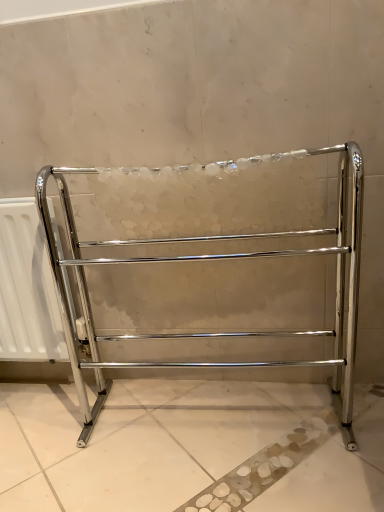
Image resolution: width=384 pixels, height=512 pixels. What do you see at coordinates (204, 260) in the screenshot?
I see `polished chrome towel rack at center` at bounding box center [204, 260].

Measure the distance between polished chrome towel rack at center and camera.

polished chrome towel rack at center is 38.34 inches away from camera.

I want to click on polished chrome towel rack at center, so click(204, 260).

What do you see at coordinates (27, 288) in the screenshot? I see `white matte radiator at left` at bounding box center [27, 288].

The height and width of the screenshot is (512, 384). I want to click on white matte radiator at left, so click(x=27, y=288).

This screenshot has height=512, width=384. In order to click on polished chrome towel rack at center in this screenshot , I will do `click(204, 260)`.

Considering the relative positions of polished chrome towel rack at center and white matte radiator at left in the image provided, is polished chrome towel rack at center to the right of white matte radiator at left from the viewer's perspective?

Correct, you'll find polished chrome towel rack at center to the right of white matte radiator at left.

Which object is more forward, polished chrome towel rack at center or white matte radiator at left?

polished chrome towel rack at center.

Between point (347, 196) and point (46, 333), which one is positioned in front?

Positioned in front is point (347, 196).

From the image's perspective, who appears lower, polished chrome towel rack at center or white matte radiator at left?

white matte radiator at left appears lower in the image.

Looking at this image, from a real-world perspective, is polished chrome towel rack at center located beneath white matte radiator at left?

Incorrect, from a real-world perspective, polished chrome towel rack at center is higher than white matte radiator at left.

Which of these two, polished chrome towel rack at center or white matte radiator at left, is thinner?

white matte radiator at left.

Which of these two, polished chrome towel rack at center or white matte radiator at left, stands taller?

polished chrome towel rack at center.

Based on their sizes in the image, would you say polished chrome towel rack at center is bigger or smaller than white matte radiator at left?

Clearly, polished chrome towel rack at center is larger in size than white matte radiator at left.

Is polished chrome towel rack at center spatially inside white matte radiator at left, or outside of it?

polished chrome towel rack at center is outside white matte radiator at left.

Is polished chrome towel rack at center in contact with white matte radiator at left?

polished chrome towel rack at center is not next to white matte radiator at left, and they're not touching.

Is polished chrome towel rack at center facing away from white matte radiator at left?

No, polished chrome towel rack at center is not facing the opposite direction of white matte radiator at left.

What's the angular difference between polished chrome towel rack at center and white matte radiator at left's facing directions?

There is a 2.97-degree angle between the facing directions of polished chrome towel rack at center and white matte radiator at left.

At what (x,y) coordinates should I click in order to perform the action: click on furniture positioned vertically above the white matte radiator at left (from a real-world perspective). Please return your answer as a coordinate pair (x, y). The height and width of the screenshot is (512, 384). Looking at the image, I should click on (204, 260).

Consider the image. Considering the positions of objects white matte radiator at left and polished chrome towel rack at center in the image provided, who is more to the left, white matte radiator at left or polished chrome towel rack at center?

white matte radiator at left.

Is the depth of white matte radiator at left greater than that of polished chrome towel rack at center?

Yes, the depth of white matte radiator at left is greater than that of polished chrome towel rack at center.

Which is in front, point (20, 340) or point (351, 433)?

Point (351, 433)

From the image's perspective, is white matte radiator at left over polished chrome towel rack at center?

No.

From a real-world perspective, is white matte radiator at left positioned above or below polished chrome towel rack at center?

Clearly, from a real-world perspective, white matte radiator at left is below polished chrome towel rack at center.

Based on the photo, does white matte radiator at left have a greater width compared to polished chrome towel rack at center?

In fact, white matte radiator at left might be narrower than polished chrome towel rack at center.

Considering the sizes of objects white matte radiator at left and polished chrome towel rack at center in the image provided, who is shorter, white matte radiator at left or polished chrome towel rack at center?

Standing shorter between the two is white matte radiator at left.

Who is smaller, white matte radiator at left or polished chrome towel rack at center?

white matte radiator at left.

Is polished chrome towel rack at center located within white matte radiator at left?

No, white matte radiator at left does not contain polished chrome towel rack at center.

Are white matte radiator at left and polished chrome towel rack at center located far from each other?

white matte radiator at left is actually quite close to polished chrome towel rack at center.

Is white matte radiator at left positioned with its back to polished chrome towel rack at center?

No, white matte radiator at left is not facing the opposite direction of polished chrome towel rack at center.

How different are the orientations of white matte radiator at left and polished chrome towel rack at center in degrees?

They differ by 2.97 degrees in their facing directions.

Measure the distance from white matte radiator at left to polished chrome towel rack at center.

They are 9.10 inches apart.

Where is `radiator below the polished chrome towel rack at center (from a real-world perspective)`? The image size is (384, 512). radiator below the polished chrome towel rack at center (from a real-world perspective) is located at coordinates (27, 288).

Where is `radiator that is under the polished chrome towel rack at center (from a real-world perspective)`? radiator that is under the polished chrome towel rack at center (from a real-world perspective) is located at coordinates (27, 288).

You are a GUI agent. You are given a task and a screenshot of the screen. Output one action in this format:
    pyautogui.click(x=<x>, y=<y>)
    Task: Click on the radiator located on the left of polished chrome towel rack at center
    
    Given the screenshot: What is the action you would take?
    pyautogui.click(x=27, y=288)